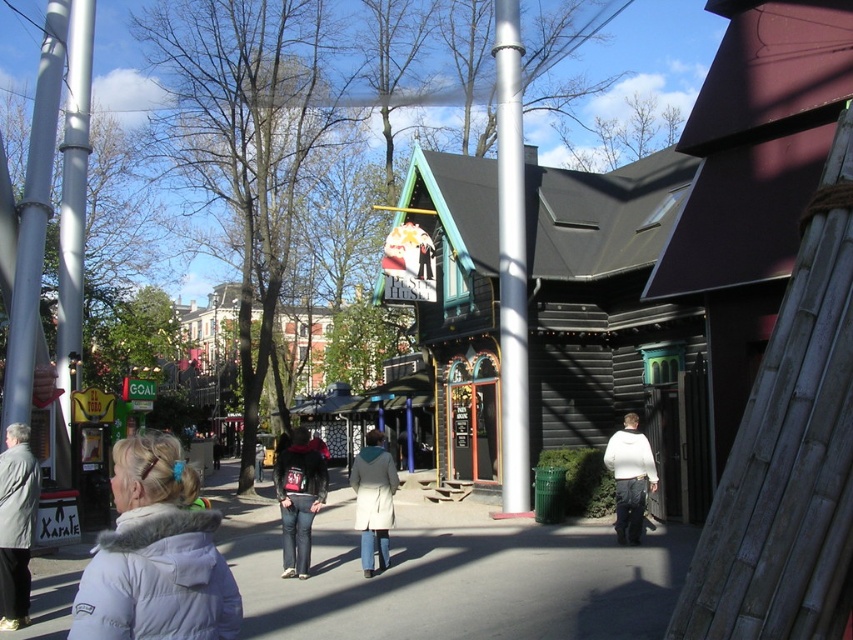
You are standing at the point marked as point (x=86, y=4) and want to walk towards the black building with a triangular roof. Is the point marked as point (x=59, y=97) blocking your path?

Point (x=59, y=97) is in front of point (x=86, y=4), so yes, the point marked as point (x=59, y=97) is blocking your path to the black building with a triangular roof.